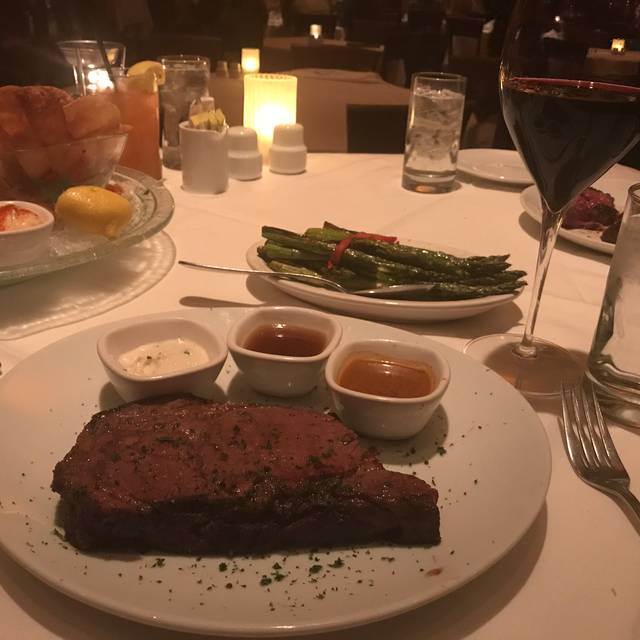
You are a GUI agent. You are given a task and a screenshot of the screen. Output one action in this format:
    pyautogui.click(x=<x>, y=<y>)
    Task: Click on the silver fork
    
    Given the screenshot: What is the action you would take?
    pyautogui.click(x=596, y=461)